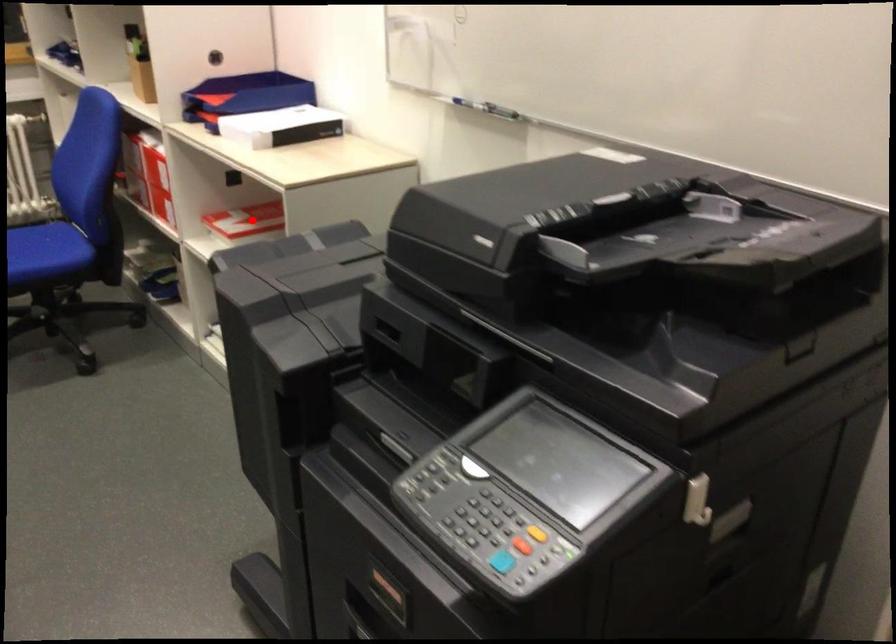
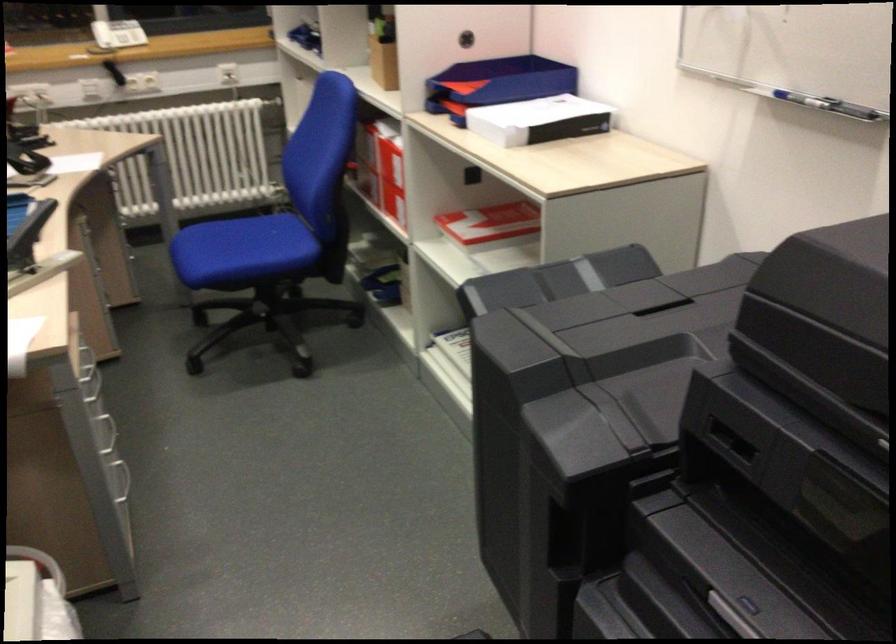
Question: A red point is marked in image1. In image2, is the corresponding 3D point closer to the camera or farther? Reply with the corresponding letter.

Choices:
 (A) The corresponding 3D point is closer.
 (B) The corresponding 3D point is farther.

Answer: (A)